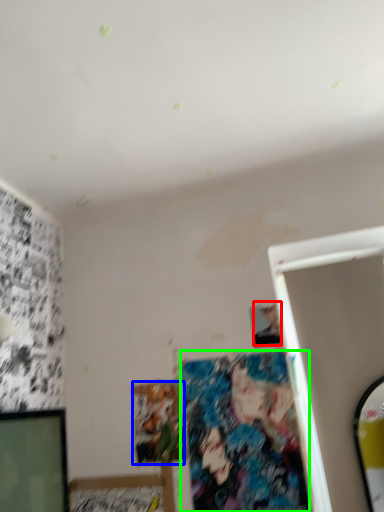
Question: Which object is positioned farthest from person (highlighted by a red box)? Select from art (highlighted by a blue box) and art (highlighted by a green box).

Choices:
 (A) art
 (B) art

Answer: (A)